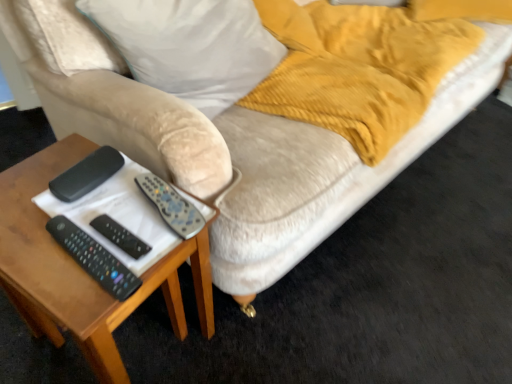
You are a GUI agent. You are given a task and a screenshot of the screen. Output one action in this format:
    pyautogui.click(x=<x>, y=<y>)
    Task: Click on the unoccupied region to the right of wooden table at lower left
    
    Given the screenshot: What is the action you would take?
    pyautogui.click(x=265, y=330)